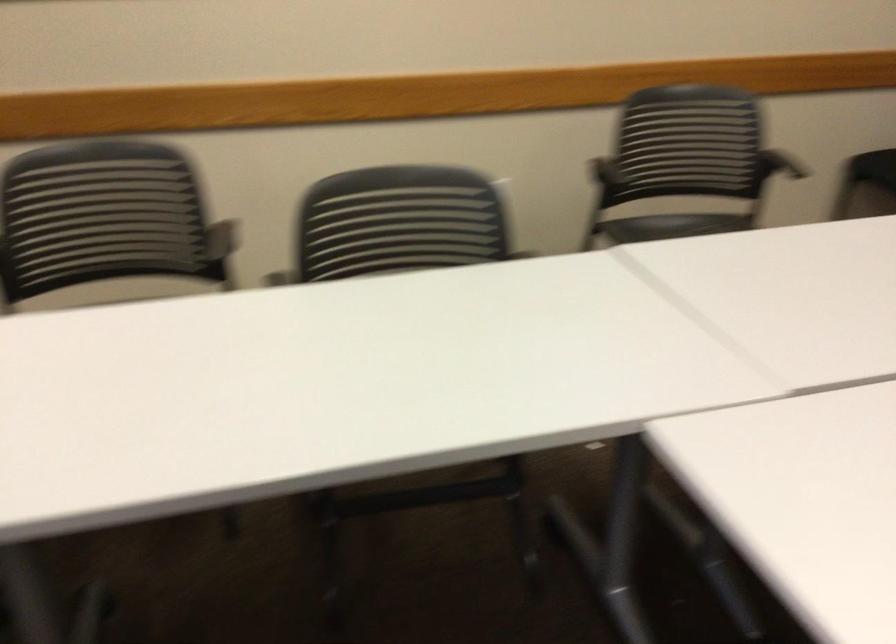
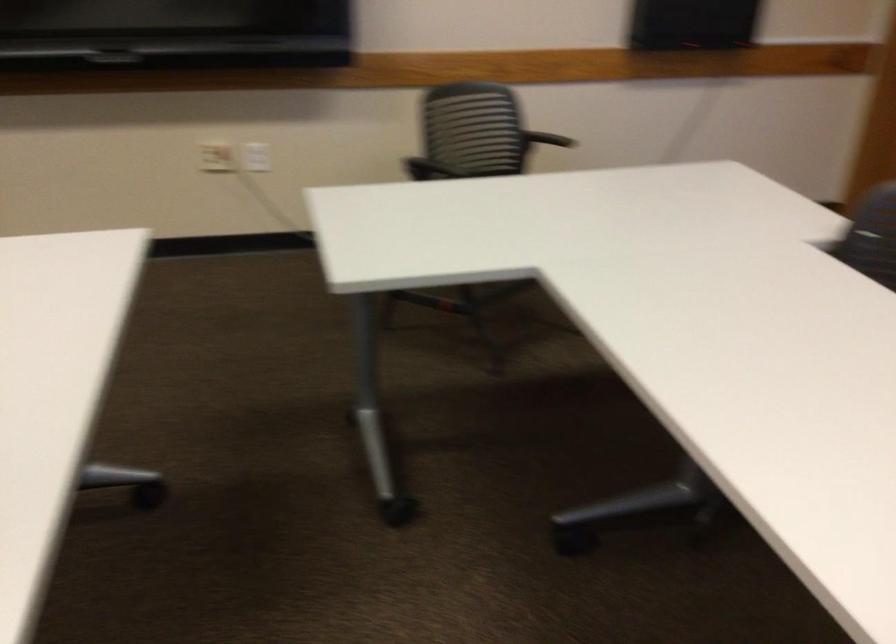
Based on the continuous images, in which direction is the camera rotating?

The rotation direction of the camera is right-down.